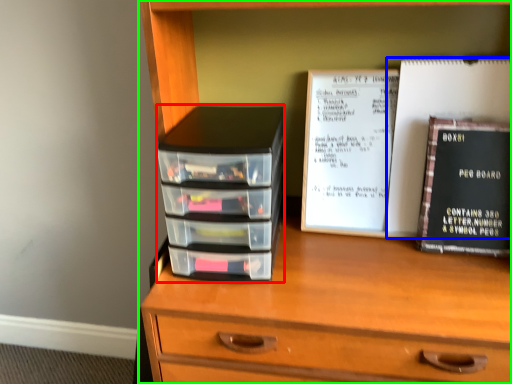
Question: Which is nearer to the stack (highlighted by a red box)? paperback book (highlighted by a blue box) or chest of drawers (highlighted by a green box).

Choices:
 (A) paperback book
 (B) chest of drawers

Answer: (B)